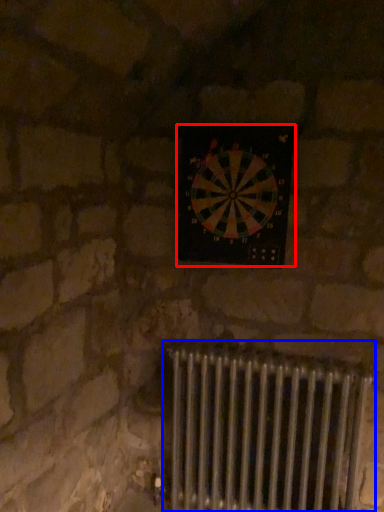
Question: Which of the following is the farthest to the observer, wall clock (highlighted by a red box) or radiator (highlighted by a blue box)?

Choices:
 (A) wall clock
 (B) radiator

Answer: (A)